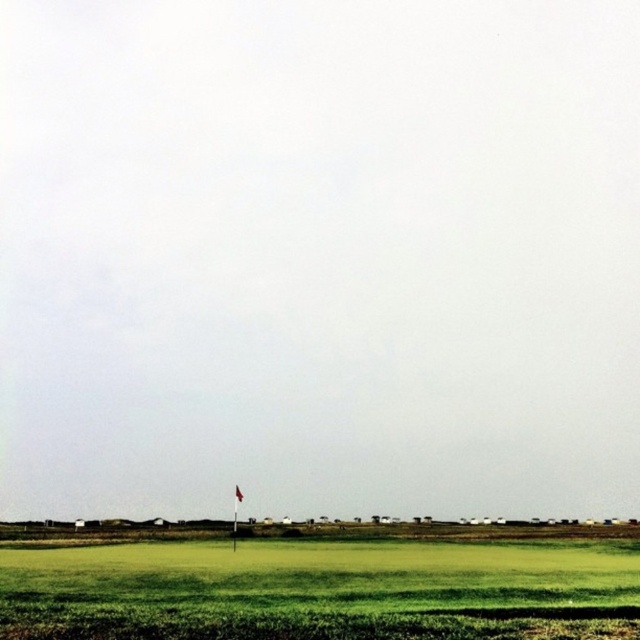
You are a golfer trying to hit a ball from the green grassy field at lower center to the red fabric flag at center. Considering the height difference between them, which object will the ball need to go over first?

The ball will need to go over the green grassy field at lower center first because it is much taller than the red fabric flag at center.